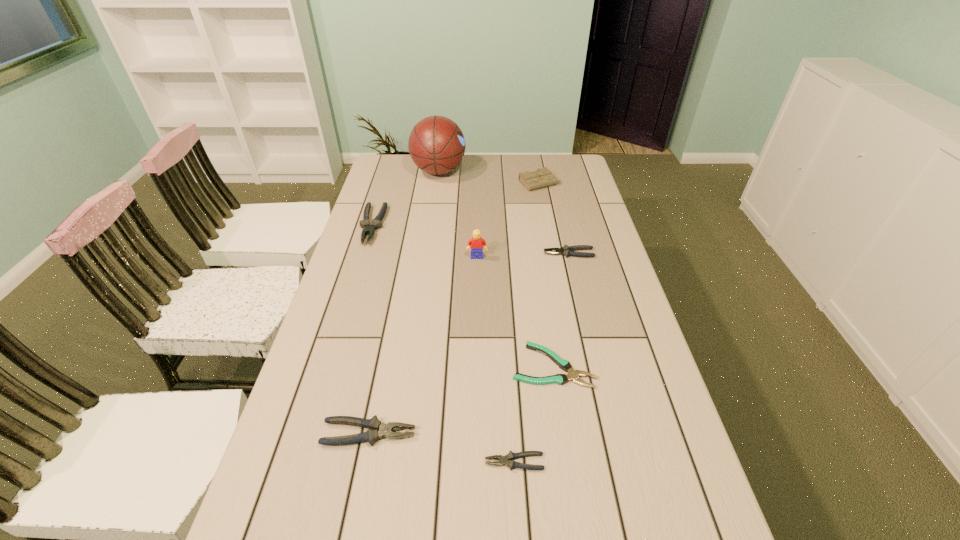
Locate an element on the screen. the eighth closest object to the basketball is located at coordinates (644, 538).

Locate an element on the screen. The width and height of the screenshot is (960, 540). object that can be found as the sixth closest to the sixth farthest object is located at coordinates (376, 223).

At what (x,y) coordinates should I click in order to perform the action: click on pliers that stands as the sixth closest to the second tallest object. Please return your answer as a coordinate pair (x, y). The image size is (960, 540). Looking at the image, I should click on (x=644, y=538).

Point out which pliers is positioned as the third nearest to the diary. Please provide its 2D coordinates. Your answer should be formatted as a tuple, i.e. [(x, y)], where the tuple contains the x and y coordinates of a point satisfying the conditions above.

[(573, 375)]

Identify which gray pliers is located as the fourth nearest to the basketball. Please provide its 2D coordinates. Your answer should be formatted as a tuple, i.e. [(x, y)], where the tuple contains the x and y coordinates of a point satisfying the conditions above.

[(511, 456)]

Select which gray pliers is the third closest to the sixth shortest object. Please provide its 2D coordinates. Your answer should be formatted as a tuple, i.e. [(x, y)], where the tuple contains the x and y coordinates of a point satisfying the conditions above.

[(511, 456)]

Locate an element on the screen. The width and height of the screenshot is (960, 540). teal pliers that stands as the closest to the diary is located at coordinates (573, 375).